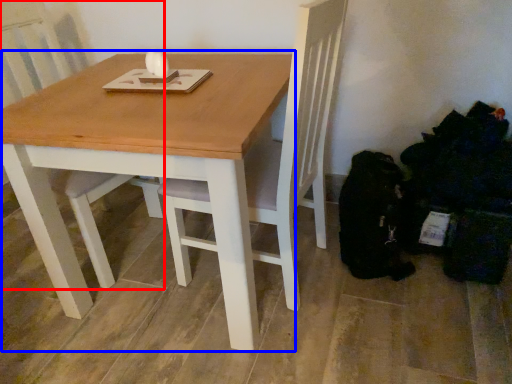
Question: Which of the following is the closest to the observer, chair (highlighted by a red box) or table (highlighted by a blue box)?

Choices:
 (A) chair
 (B) table

Answer: (B)